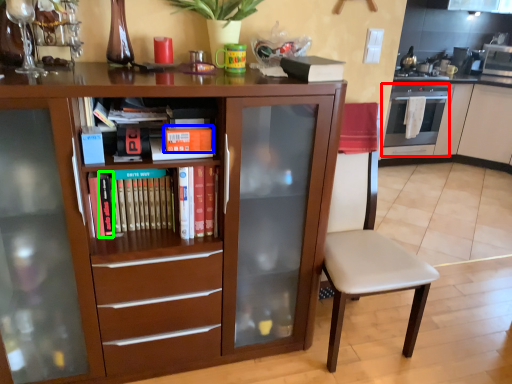
Question: Which object is the closest to the oven (highlighted by a red box)? Choose among these: paperback book (highlighted by a blue box) or paperback book (highlighted by a green box).

Choices:
 (A) paperback book
 (B) paperback book

Answer: (A)